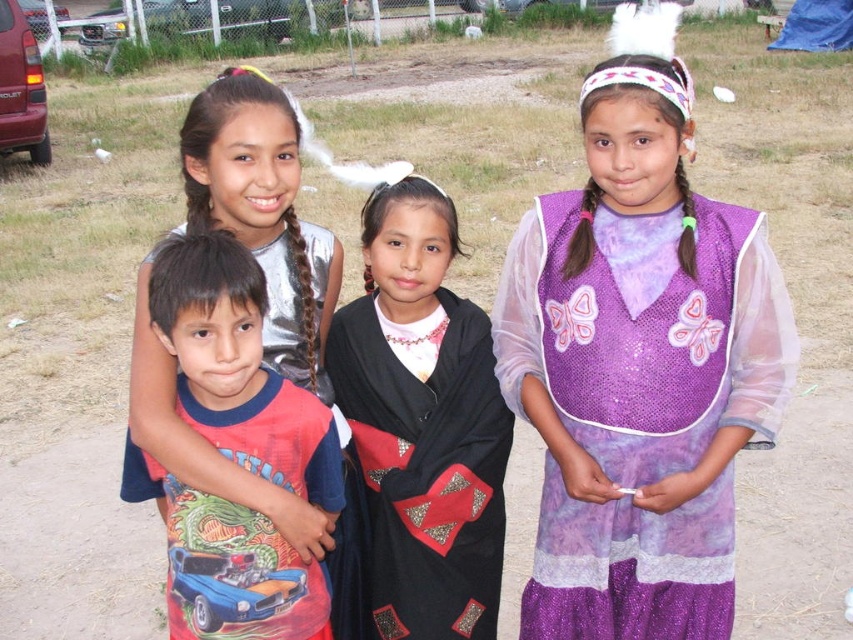
Which is more to the left, purple sequined dress at center or black sequined shawl at center?

black sequined shawl at center is more to the left.

Does purple sequined dress at center come behind black sequined shawl at center?

That is False.

This screenshot has height=640, width=853. Identify the location of purple sequined dress at center. (646, 333).

I want to click on purple sequined dress at center, so click(x=646, y=333).

Does black sequined shawl at center appear under silver metallic dress at upper left?

Correct, black sequined shawl at center is located below silver metallic dress at upper left.

Between black sequined shawl at center and silver metallic dress at upper left, which one is positioned lower?

Positioned lower is black sequined shawl at center.

What do you see at coordinates (418, 480) in the screenshot?
I see `black sequined shawl at center` at bounding box center [418, 480].

Image resolution: width=853 pixels, height=640 pixels. In order to click on black sequined shawl at center in this screenshot , I will do `click(418, 480)`.

Consider the image. Which is above, black sequined shawl at center or red t-shirt at center?

red t-shirt at center is above.

Based on the photo, can you confirm if black sequined shawl at center is wider than red t-shirt at center?

In fact, black sequined shawl at center might be narrower than red t-shirt at center.

Locate an element on the screen. This screenshot has width=853, height=640. black sequined shawl at center is located at coordinates 418,480.